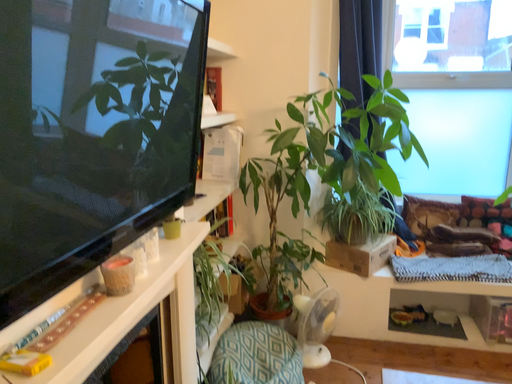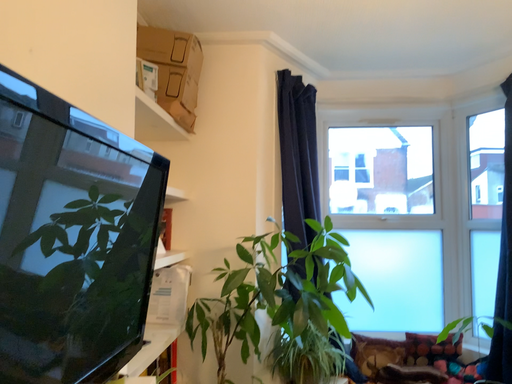
Question: Which way did the camera rotate in the video?

Choices:
 (A) rotated right
 (B) rotated left

Answer: (A)